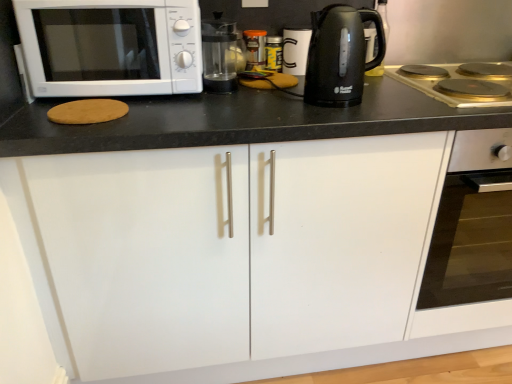
Question: Is metallic silver canister at center, the 2th appliance in the right-to-left sequence, situated inside transparent glass coffee machine at center or outside?

Choices:
 (A) outside
 (B) inside

Answer: (A)

Question: Is metallic silver canister at center, the 2th appliance in the right-to-left sequence, in front of or behind transparent glass coffee machine at center in the image?

Choices:
 (A) behind
 (B) front

Answer: (A)

Question: Based on their relative distances, which object is nearer to the white matte cabinet at center?

Choices:
 (A) gold-coated stovetop at right
 (B) white matte microwave at left
 (C) transparent glass coffee machine at center
 (D) white ceramic mug at upper center, which ranks as the 2th appliance in left-to-right order
 (E) black glossy electric kettle at upper right

Answer: (B)

Question: Estimate the real-world distances between objects in this image. Which object is closer to the white ceramic mug at upper center, the 1th appliance from the right?

Choices:
 (A) gold-coated stovetop at right
 (B) transparent glass coffee machine at center
 (C) white matte cabinet at center
 (D) metallic silver canister at center, the 2th appliance in the right-to-left sequence
 (E) black glossy electric kettle at upper right

Answer: (D)